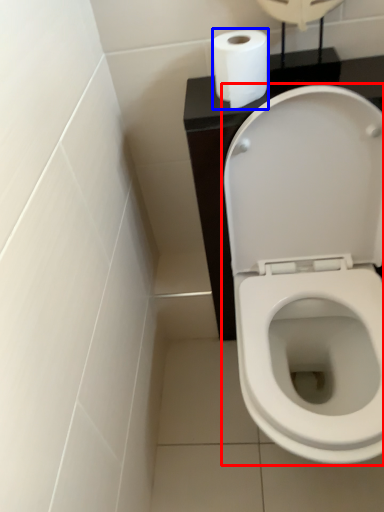
Question: Among these objects, which one is farthest to the camera, toilet (highlighted by a red box) or toilet paper (highlighted by a blue box)?

Choices:
 (A) toilet
 (B) toilet paper

Answer: (B)